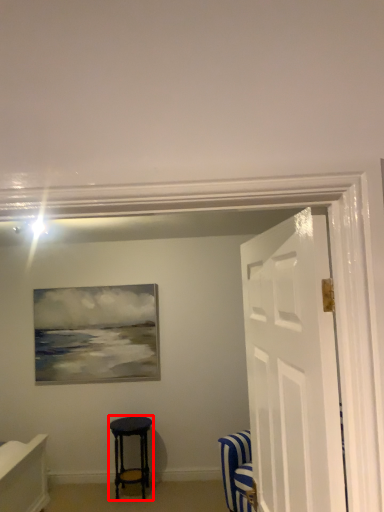
Question: In this image, where is stool (annotated by the red box) located relative to door?

Choices:
 (A) left
 (B) right

Answer: (A)